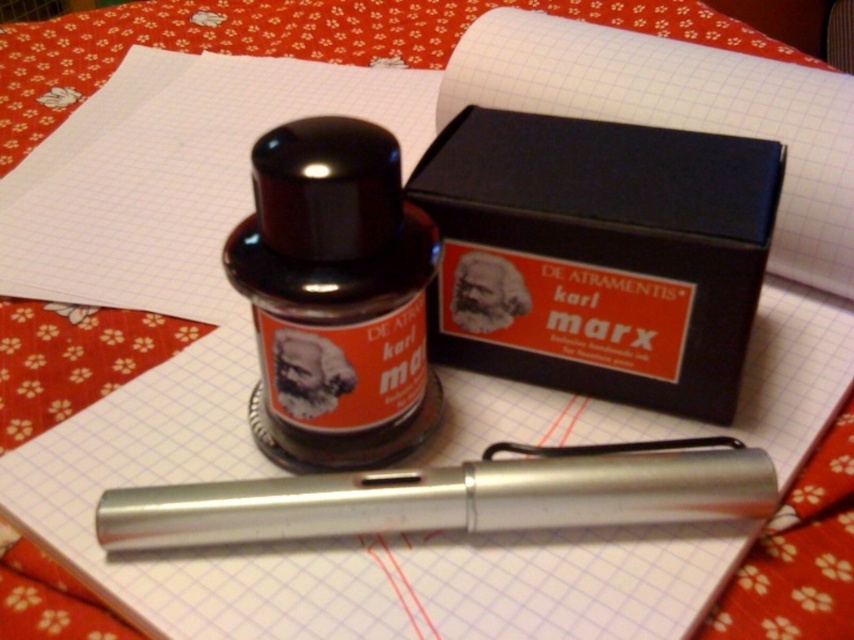
Question: Among these objects, which one is farthest from the camera?

Choices:
 (A) silver metallic pen at center
 (B) black glass bottle at center

Answer: (A)

Question: Does black glass bottle at center have a greater width compared to silver metallic pen at center?

Choices:
 (A) yes
 (B) no

Answer: (B)

Question: Considering the real-world distances, which object is closest to the silver metallic pen at center?

Choices:
 (A) black glass bottle at center
 (B) black cardboard box at center

Answer: (A)

Question: Is black cardboard box at center wider than black glass bottle at center?

Choices:
 (A) no
 (B) yes

Answer: (B)

Question: Which object is positioned farthest from the black cardboard box at center?

Choices:
 (A) silver metallic pen at center
 (B) black glass bottle at center

Answer: (A)

Question: Is black cardboard box at center positioned before silver metallic pen at center?

Choices:
 (A) no
 (B) yes

Answer: (A)